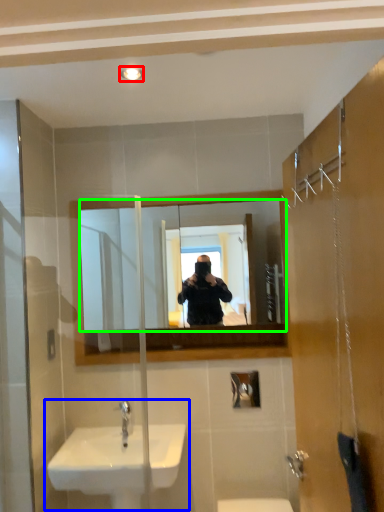
Question: Which is farther away from light fixture (highlighted by a red box)? sink (highlighted by a blue box) or mirror (highlighted by a green box)?

Choices:
 (A) sink
 (B) mirror

Answer: (A)